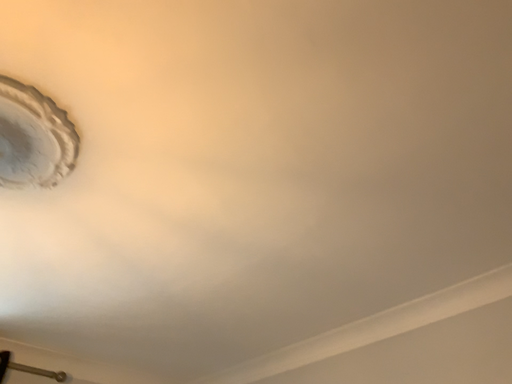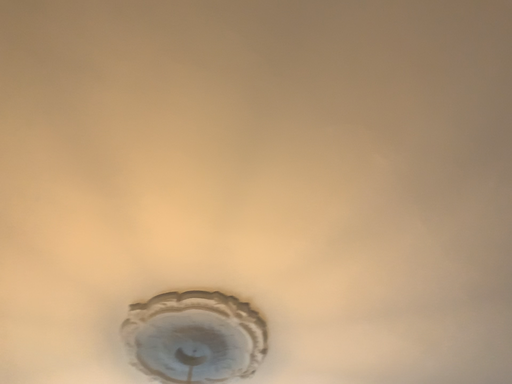
Question: Which way did the camera rotate in the video?

Choices:
 (A) rotated left
 (B) rotated right

Answer: (A)